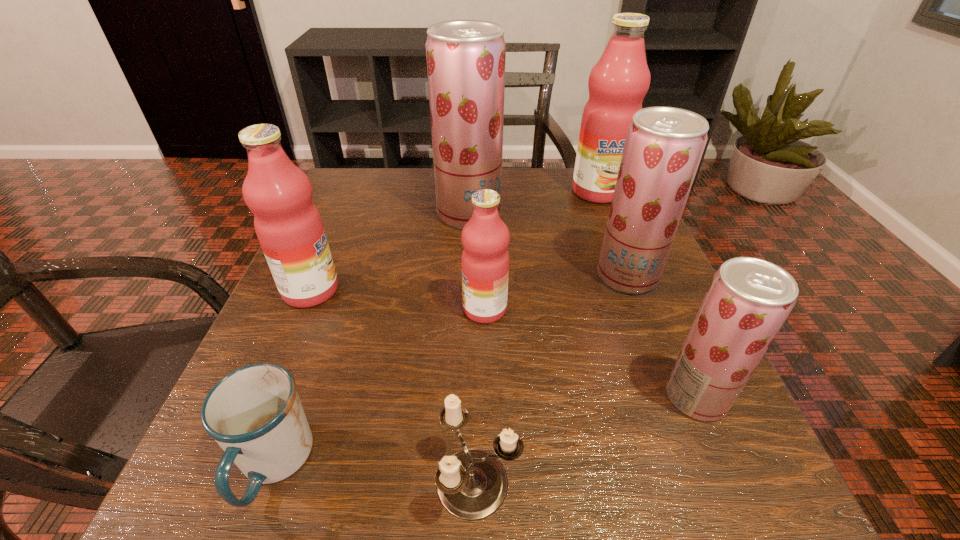
This screenshot has height=540, width=960. I want to click on free point that satisfies the following two spatial constraints: 1. on the back side of the nearest strawberry fruit juice; 2. on the label of the second pink fruit juice from right to left, so click(x=659, y=309).

Where is `free region that satisfies the following two spatial constraints: 1. on the label of the farthest pink fruit juice; 2. on the label of the second pink fruit juice from left to right`? free region that satisfies the following two spatial constraints: 1. on the label of the farthest pink fruit juice; 2. on the label of the second pink fruit juice from left to right is located at coordinates (644, 309).

This screenshot has width=960, height=540. Identify the location of vacant space that satisfies the following two spatial constraints: 1. on the label of the nearest strawberry fruit juice; 2. on the right side of the smallest pink fruit juice. (486, 397).

Find the location of a particular element. This screenshot has height=540, width=960. free space that satisfies the following two spatial constraints: 1. on the label of the leftmost pink fruit juice; 2. on the back side of the candle holder is located at coordinates (229, 482).

Where is `vacant region that satisfies the following two spatial constraints: 1. on the handle side of the mug; 2. on the right side of the candle holder`? This screenshot has height=540, width=960. vacant region that satisfies the following two spatial constraints: 1. on the handle side of the mug; 2. on the right side of the candle holder is located at coordinates (267, 482).